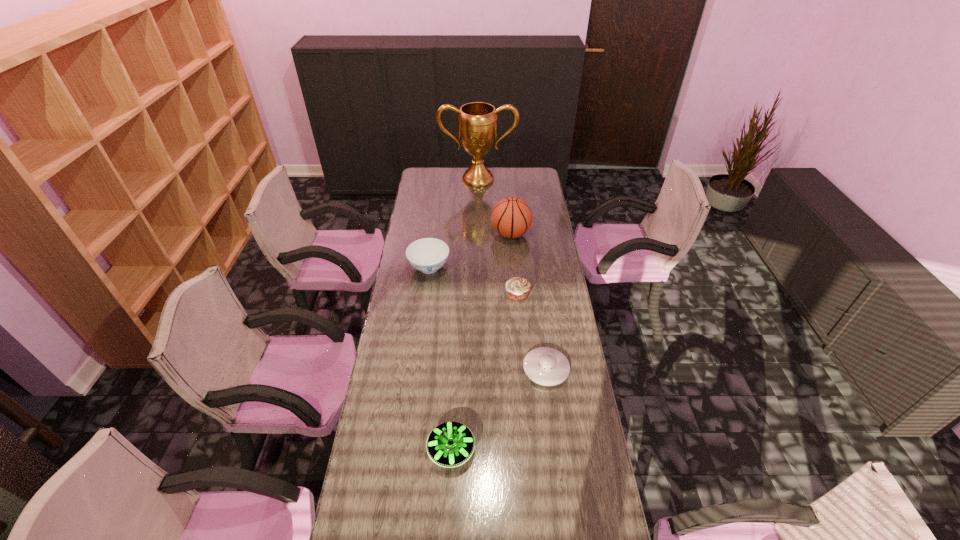
Find the location of a particular element. Image resolution: width=960 pixels, height=540 pixels. vacant space at the far left corner is located at coordinates (441, 182).

Find the location of a particular element. vacant area between the farthest object and the farther saucer is located at coordinates (512, 274).

This screenshot has width=960, height=540. What are the coordinates of `free space between the chinaware and the second tallest object` in the screenshot? It's located at (469, 251).

I want to click on free space between the second farthest object and the muffin, so click(514, 265).

At what (x,y) coordinates should I click in order to perform the action: click on empty location between the muffin and the chinaware. Please return your answer as a coordinate pair (x, y). The image size is (960, 540). Looking at the image, I should click on (473, 281).

Locate an element on the screen. The height and width of the screenshot is (540, 960). free space between the tallest object and the chinaware is located at coordinates (453, 224).

The image size is (960, 540). I want to click on vacant point located between the farthest object and the taller saucer, so click(x=465, y=314).

The width and height of the screenshot is (960, 540). I want to click on free space between the chinaware and the shortest object, so click(x=488, y=318).

The height and width of the screenshot is (540, 960). I want to click on the closest object to the nearer saucer, so click(546, 366).

Locate an element on the screen. The image size is (960, 540). the fifth closest object to the chinaware is located at coordinates (450, 444).